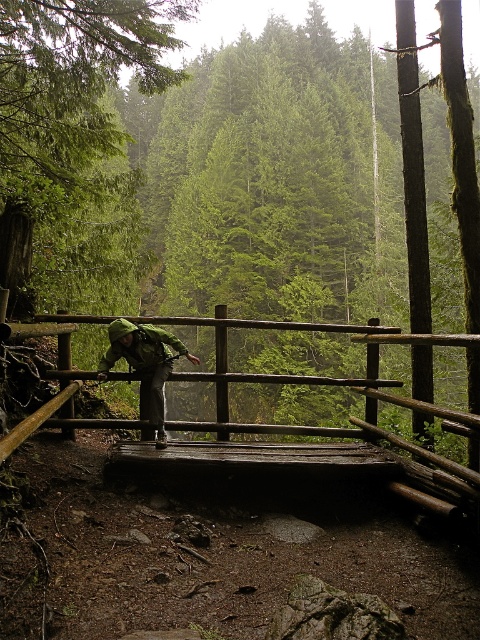
You are standing on the wooden bridge in the forest scene. You notice two points marked on the bridge. The first point is at coordinates point (373, 385) and the second point is at point (145, 436). If you are facing the direction of the bridge, which point is closer to you?

Point (373, 385) is in front of point (145, 436), so if you are facing the direction of the bridge, point (373, 385) is closer to you.

You are a hiker who wants to take a photo of both the green camouflage jacket at center and the green matte jacket at center from the bridge. Can you fit both jackets in your camera frame if your camera has a minimum distance of 3 inches between subjects to focus properly?

The green camouflage jacket at center is 3.54 inches away from green matte jacket at center. Since the camera requires a minimum of 3 inches between subjects, the 3.54 inches distance is sufficient, so both jackets can be captured in focus.